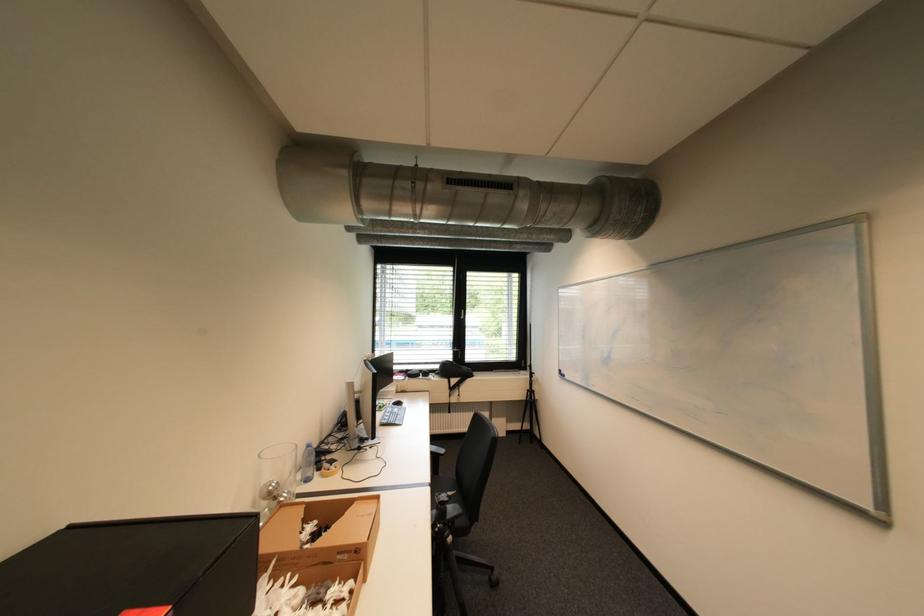
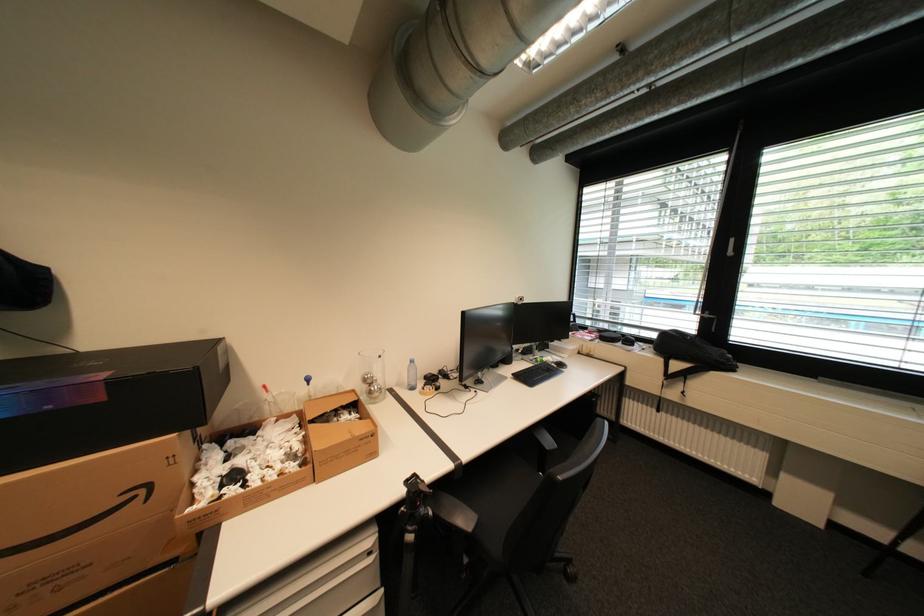
In the second image, find the point that corresponds to (x=475, y=361) in the first image.

(739, 339)